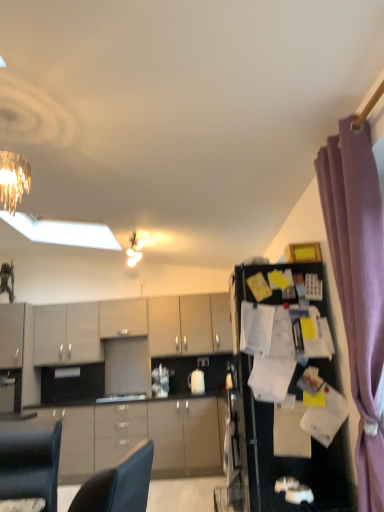
Question: Which direction should I rotate to face matte gray cabinets at center, which is the 2th cabinetry from bottom to top, — up or down?

Choices:
 (A) down
 (B) up

Answer: (A)

Question: Considering the relative positions of matte gray cabinet at center, placed as the first cabinetry when sorted from top to bottom, and metallic chandelier at upper center in the image provided, is matte gray cabinet at center, placed as the first cabinetry when sorted from top to bottom, to the left of metallic chandelier at upper center from the viewer's perspective?

Choices:
 (A) yes
 (B) no

Answer: (A)

Question: From a real-world perspective, is matte gray cabinet at center, the 4th cabinetry when ordered from bottom to top, positioned under metallic chandelier at upper center based on gravity?

Choices:
 (A) no
 (B) yes

Answer: (B)

Question: Could you tell me if matte gray cabinet at center, placed as the first cabinetry when sorted from top to bottom, is turned towards metallic chandelier at upper center?

Choices:
 (A) no
 (B) yes

Answer: (A)

Question: Is matte gray cabinet at center, the 4th cabinetry when ordered from bottom to top, positioned beyond the bounds of metallic chandelier at upper center?

Choices:
 (A) yes
 (B) no

Answer: (A)

Question: From a real-world perspective, is matte gray cabinet at center, placed as the first cabinetry when sorted from top to bottom, positioned over metallic chandelier at upper center based on gravity?

Choices:
 (A) yes
 (B) no

Answer: (B)

Question: Is matte gray cabinet at center, the 4th cabinetry when ordered from bottom to top, positioned far away from metallic chandelier at upper center?

Choices:
 (A) no
 (B) yes

Answer: (A)

Question: Is glossy wood cabinets at center, which is the 1th cabinetry in bottom-to-top order, completely or partially inside matte gray cabinets at center, which is counted as the 3th cabinetry, starting from the top?

Choices:
 (A) yes
 (B) no

Answer: (B)

Question: Is matte gray cabinets at center, which is counted as the 3th cabinetry, starting from the top, with glossy wood cabinets at center, which is the 1th cabinetry in bottom-to-top order?

Choices:
 (A) no
 (B) yes

Answer: (A)

Question: Considering the relative sizes of matte gray cabinets at center, which is the 2th cabinetry from bottom to top, and glossy wood cabinets at center, the 4th cabinetry in the top-to-bottom sequence, in the image provided, is matte gray cabinets at center, which is the 2th cabinetry from bottom to top, thinner than glossy wood cabinets at center, the 4th cabinetry in the top-to-bottom sequence,?

Choices:
 (A) no
 (B) yes

Answer: (B)

Question: Would you say matte gray cabinets at center, which is counted as the 3th cabinetry, starting from the top, is a long distance from glossy wood cabinets at center, which is the 1th cabinetry in bottom-to-top order?

Choices:
 (A) no
 (B) yes

Answer: (B)

Question: From the image's perspective, is matte gray cabinets at center, which is the 2th cabinetry from bottom to top, located above glossy wood cabinets at center, the 4th cabinetry in the top-to-bottom sequence?

Choices:
 (A) no
 (B) yes

Answer: (B)

Question: Does matte gray cabinets at center, which is the 2th cabinetry from bottom to top, have a larger size compared to glossy wood cabinets at center, the 4th cabinetry in the top-to-bottom sequence?

Choices:
 (A) yes
 (B) no

Answer: (B)

Question: Is matte gray cabinet at center, the 4th cabinetry when ordered from bottom to top, further to the viewer compared to glossy wood cabinets at center, the 4th cabinetry in the top-to-bottom sequence?

Choices:
 (A) no
 (B) yes

Answer: (B)